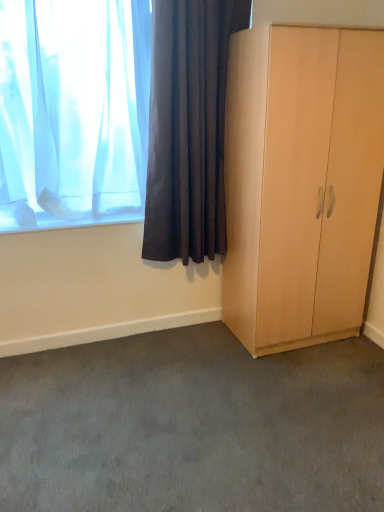
The image size is (384, 512). I want to click on free location to the left of light wood wardrobe at right, so click(x=196, y=349).